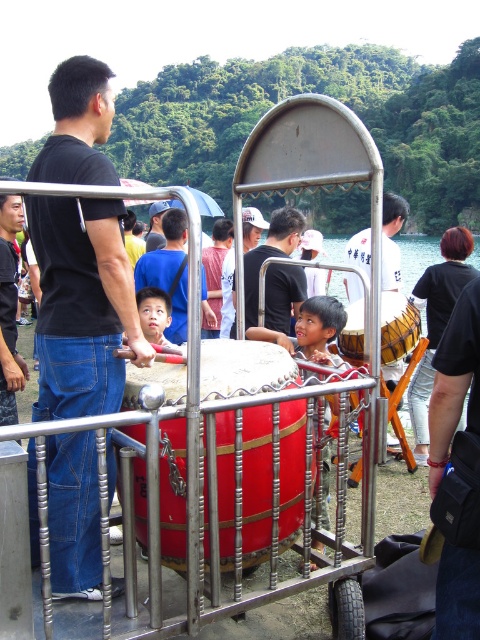
Locate an element on the screen. The height and width of the screenshot is (640, 480). black matte shirt at upper left is located at coordinates (82, 305).

This screenshot has width=480, height=640. I want to click on black matte shirt at upper left, so click(82, 305).

Which is behind, point (52, 440) or point (16, 355)?

Positioned behind is point (16, 355).

Locate an element on the screen. Image resolution: width=480 pixels, height=640 pixels. black matte shirt at upper left is located at coordinates (82, 305).

Who is shorter, matte black shirt at center or matte white shirt at center?

matte black shirt at center is shorter.

Can you confirm if matte black shirt at center is positioned below matte white shirt at center?

Indeed, matte black shirt at center is positioned under matte white shirt at center.

Is point (305, 282) positioned in front of point (394, 200)?

Yes, it is in front of point (394, 200).

This screenshot has height=640, width=480. Find the location of `matte black shirt at center`. matte black shirt at center is located at coordinates (269, 256).